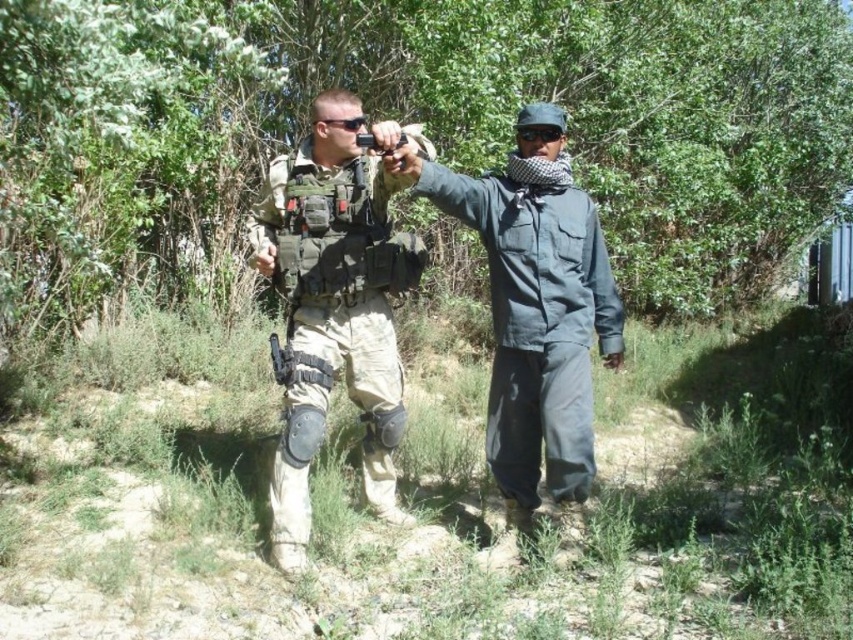
Question: Does tan/camouflage uniform at center appear over dark blue uniform at center?

Choices:
 (A) no
 (B) yes

Answer: (A)

Question: Can you confirm if tan/camouflage uniform at center is positioned to the right of dark blue uniform at center?

Choices:
 (A) no
 (B) yes

Answer: (A)

Question: Which point is closer to the camera?

Choices:
 (A) (300, 564)
 (B) (592, 276)

Answer: (A)

Question: Is tan/camouflage uniform at center to the left of dark blue uniform at center from the viewer's perspective?

Choices:
 (A) no
 (B) yes

Answer: (B)